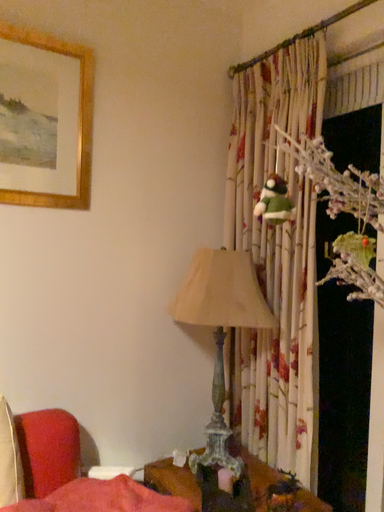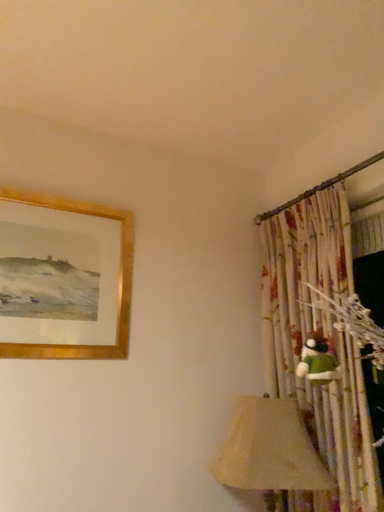
Question: Which way did the camera rotate in the video?

Choices:
 (A) rotated downward
 (B) rotated upward

Answer: (B)